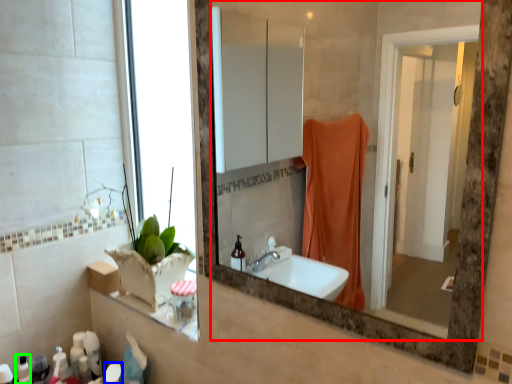
Question: Which is nearer to the mirror (highlighted by a red box)? toiletry (highlighted by a blue box) or toiletry (highlighted by a green box).

Choices:
 (A) toiletry
 (B) toiletry

Answer: (A)